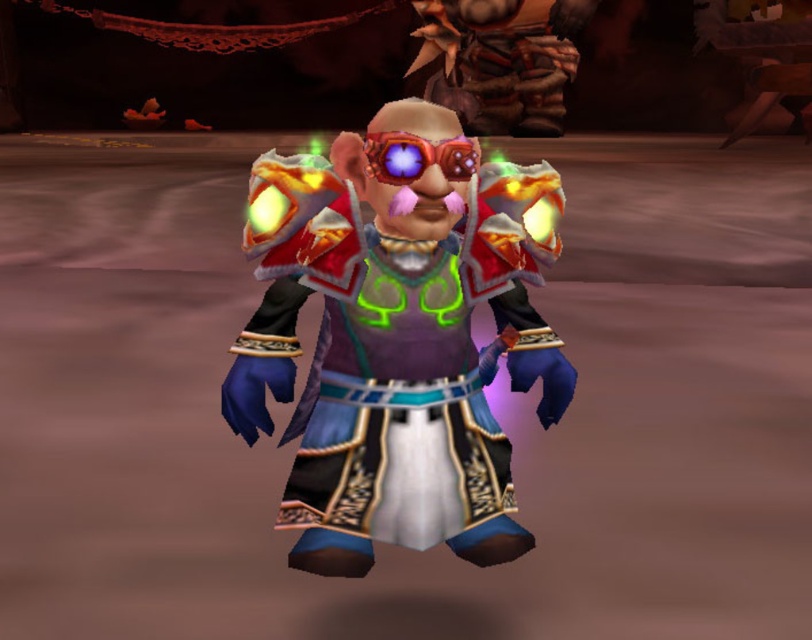
Looking at this image, you are a game developer designing a character model. You need to ensure that the shiny metallic armor at center and the translucent red goggles at center are positioned correctly according to the game engine guidelines. Based on the scene description, which object is placed lower on the character?

The shiny metallic armor at center is located below translucent red goggles at center, so the shiny metallic armor at center is placed lower on the character.

You are a game developer designing a new character. You have two items, the shiny metallic armor at center and the translucent red goggles at center. The character model needs to have these items placed exactly 12 inches apart for proper animation. Can you place them as required?

The shiny metallic armor at center and the translucent red goggles at center are 13.39 inches apart, so they are currently placed further apart than the required 12 inches. Adjust their positions to reduce the distance between them by 1.39 inches to meet the requirement.